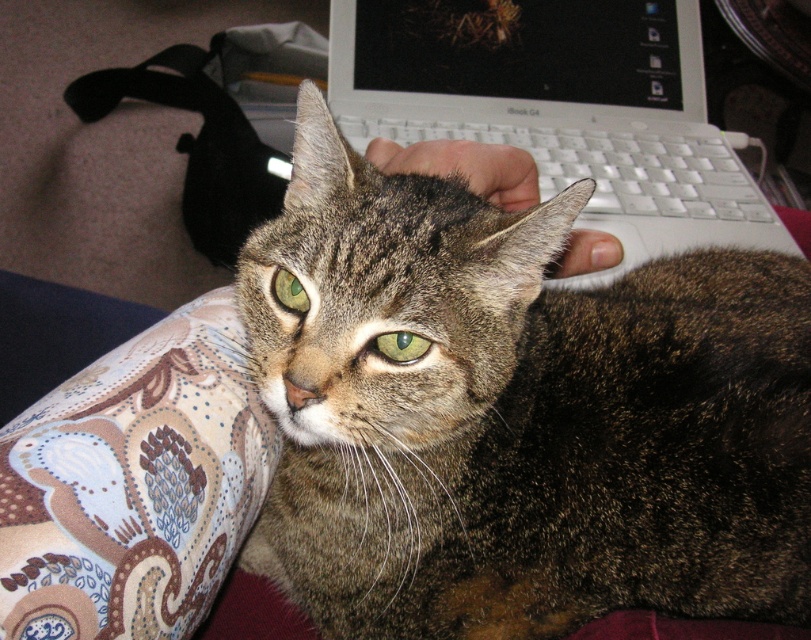
Question: Does tabby fur cat at center appear under white plastic laptop at upper center?

Choices:
 (A) no
 (B) yes

Answer: (B)

Question: Considering the real-world distances, which object is farthest from the green glossy eye at center?

Choices:
 (A) white plastic keyboard at upper center
 (B) white plastic laptop at upper center

Answer: (B)

Question: Which object is farther from the camera taking this photo?

Choices:
 (A) tabby fur cat at center
 (B) green glossy eye at center
 (C) white plastic keyboard at upper center

Answer: (C)

Question: Does tabby fur cat at center have a greater width compared to white plastic keyboard at upper center?

Choices:
 (A) yes
 (B) no

Answer: (B)

Question: Which point appears closest to the camera in this image?

Choices:
 (A) (531, 566)
 (B) (657, 72)
 (C) (421, 337)

Answer: (C)

Question: Is tabby fur cat at center smaller than white plastic laptop at upper center?

Choices:
 (A) no
 (B) yes

Answer: (B)